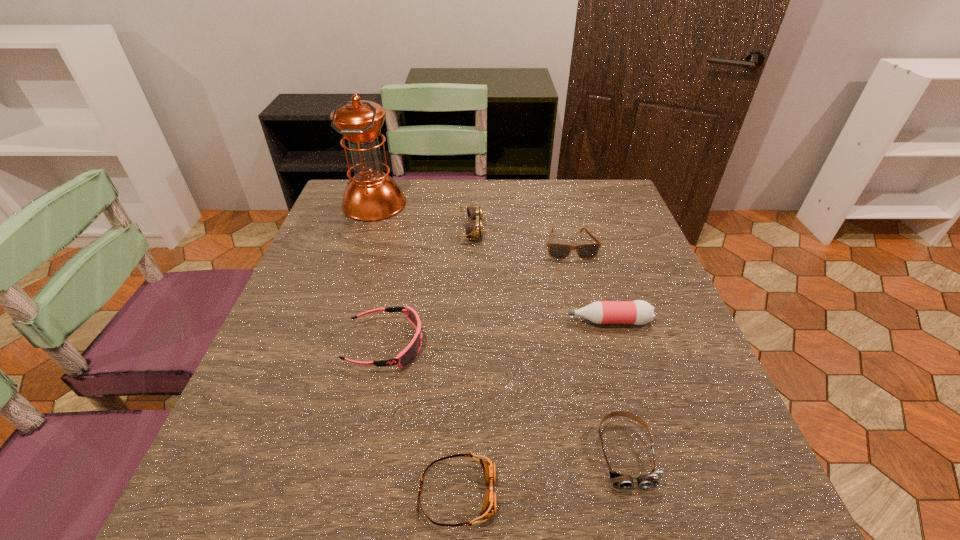
I want to click on vacant area that lies between the oil lamp and the bottle, so click(492, 263).

This screenshot has height=540, width=960. I want to click on vacant area between the leftmost goggles and the tallest object, so click(380, 274).

Where is `free space between the rightmost goggles and the leftmost goggles`? free space between the rightmost goggles and the leftmost goggles is located at coordinates (505, 399).

Locate an element on the screen. Image resolution: width=960 pixels, height=540 pixels. empty space that is in between the leftmost goggles and the tallest object is located at coordinates (380, 274).

In order to click on free space between the sunglasses and the rightmost goggles in this screenshot , I will do `click(597, 349)`.

Where is `the closest object relative to the sunglasses`? Image resolution: width=960 pixels, height=540 pixels. the closest object relative to the sunglasses is located at coordinates (474, 229).

Point out which object is positioned as the fourth nearest to the rightmost goggles. Please provide its 2D coordinates. Your answer should be formatted as a tuple, i.e. [(x, y)], where the tuple contains the x and y coordinates of a point satisfying the conditions above.

[(556, 251)]

At what (x,y) coordinates should I click in order to perform the action: click on goggles identified as the second closest to the farthest goggles. Please return your answer as a coordinate pair (x, y). Looking at the image, I should click on (623, 481).

Point out which goggles is positioned as the third nearest to the tallest object. Please provide its 2D coordinates. Your answer should be formatted as a tuple, i.e. [(x, y)], where the tuple contains the x and y coordinates of a point satisfying the conditions above.

[(489, 507)]